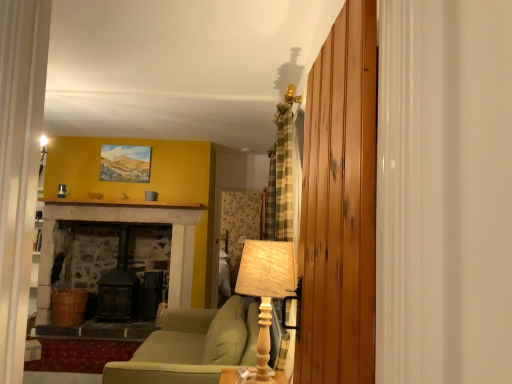
Question: In terms of size, does wooden planks at right appear bigger or smaller than woven fabric lampshade at right?

Choices:
 (A) small
 (B) big

Answer: (B)

Question: Is wooden planks at right in front of or behind woven fabric lampshade at right in the image?

Choices:
 (A) behind
 (B) front

Answer: (B)

Question: Based on their relative distances, which object is farther from the green fabric couch at center?

Choices:
 (A) wooden planks at right
 (B) woven fabric lampshade at right
 (C) matte oil painting at upper center

Answer: (C)

Question: Considering the real-world distances, which object is closest to the green fabric couch at center?

Choices:
 (A) woven fabric lampshade at right
 (B) matte oil painting at upper center
 (C) wooden planks at right

Answer: (A)